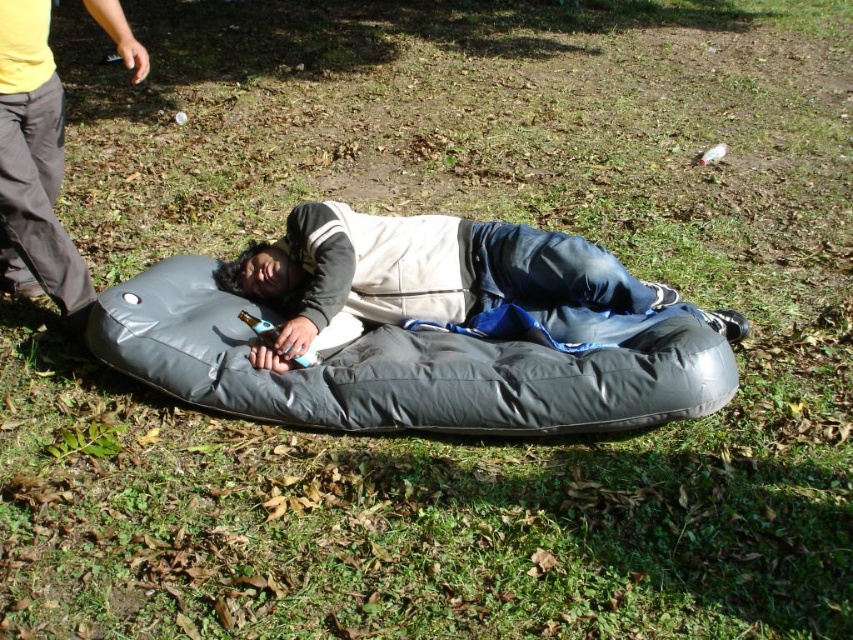
You are planning to sit on either the gray fabric bean bag chair at center or the matte black inflatable at left. Which one has a wider sitting area?

The gray fabric bean bag chair at center has a wider sitting area since its width is larger than the matte black inflatable at left.

You are planning to place a large book on the gray fabric bean bag chair at center and a small notebook on the matte black inflatable at left. Which surface will the book and notebook fit better on based on their sizes?

The gray fabric bean bag chair at center is bigger than the matte black inflatable at left, so the large book will fit better on the gray fabric bean bag chair at center and the small notebook will fit better on the matte black inflatable at left.